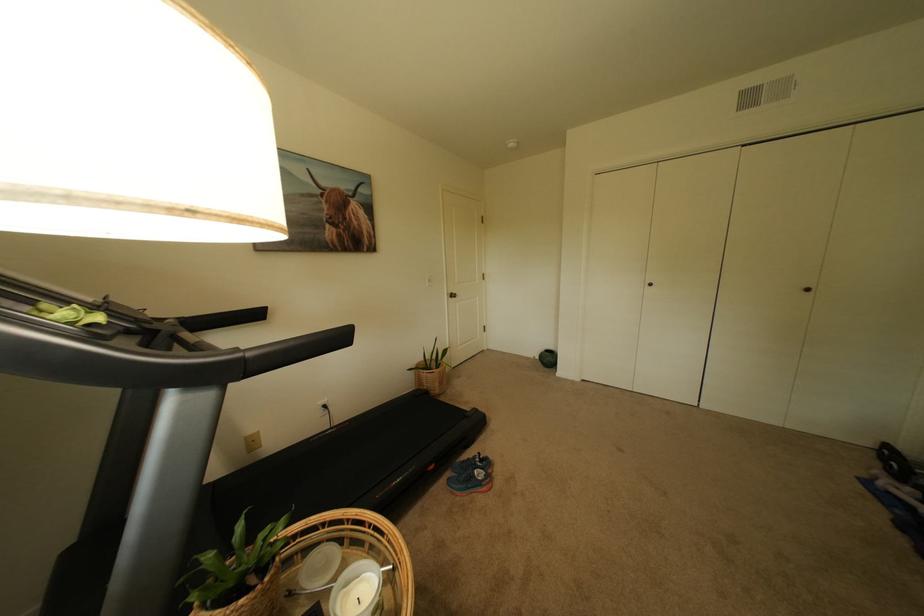
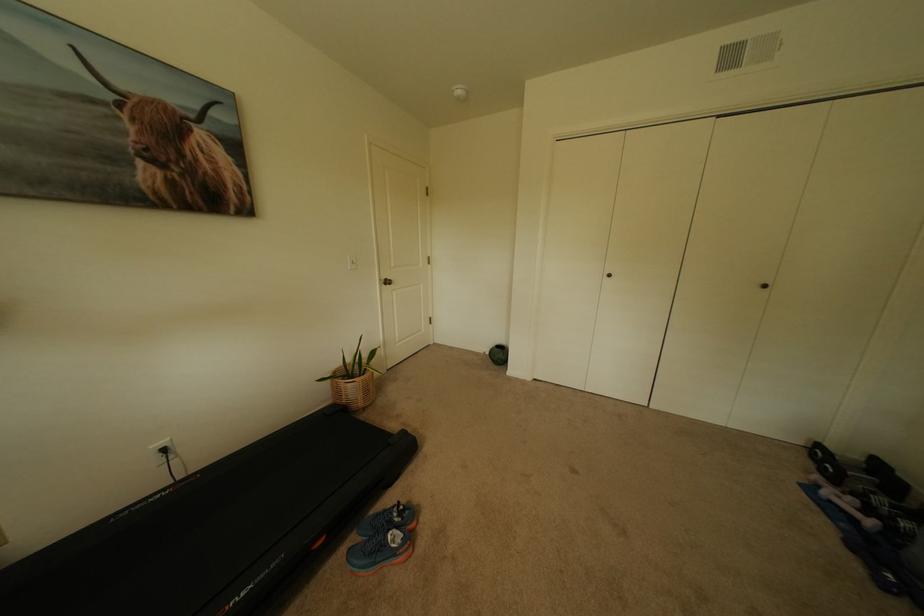
Locate, in the second image, the point that corresponds to pixel 446 385 in the first image.

(370, 395)